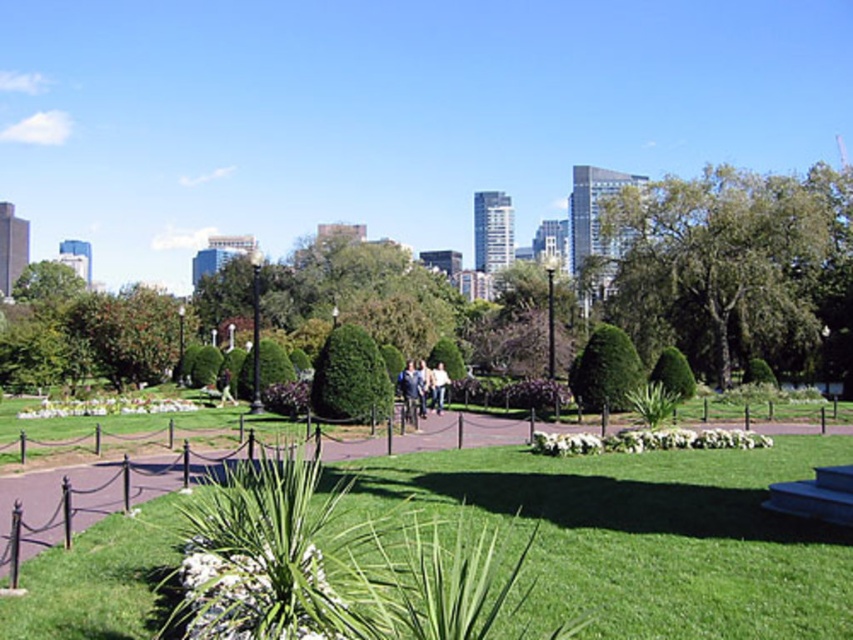
Question: Considering the real-world distances, which object is closest to the blue denim jeans at center?

Choices:
 (A) green grass at center
 (B) white cotton shirt at center
 (C) green textured bush at center
 (D) green leafy tree at center-right

Answer: (B)

Question: Does blue denim jeans at center appear on the left side of white cotton shirt at center?

Choices:
 (A) no
 (B) yes

Answer: (B)

Question: Is green grass at center bigger than green textured bush at center?

Choices:
 (A) yes
 (B) no

Answer: (A)

Question: Does green textured bush at center lie behind blue denim jeans at center?

Choices:
 (A) yes
 (B) no

Answer: (B)

Question: Which object is positioned closest to the blue denim jeans at center?

Choices:
 (A) green grass at center
 (B) green leafy tree at center-right

Answer: (A)

Question: Among these objects, which one is nearest to the camera?

Choices:
 (A) white cotton shirt at center
 (B) green grass at center
 (C) green leafy tree at center-right

Answer: (B)